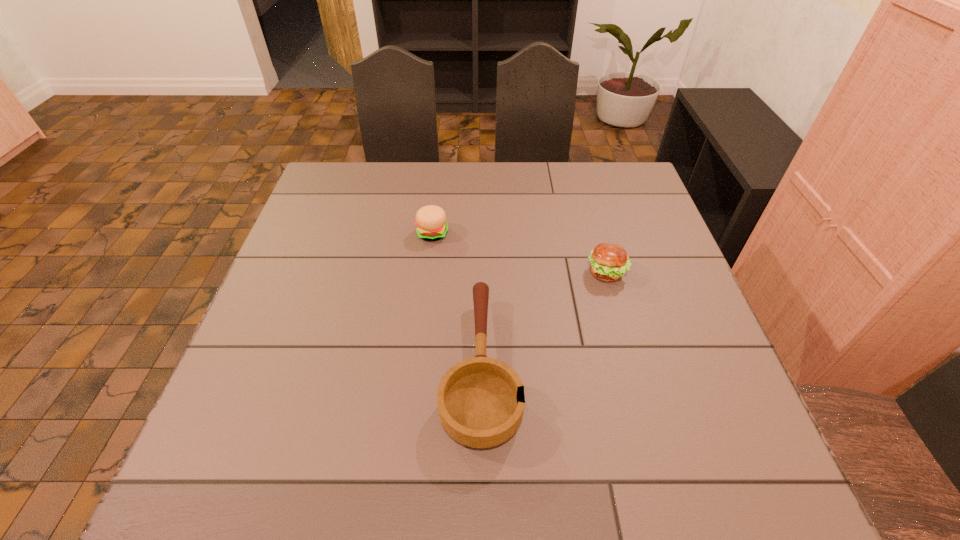
The image size is (960, 540). I want to click on vacant region located 0.310m with the handle on the side of the nearest object, so click(x=481, y=218).

The height and width of the screenshot is (540, 960). Find the location of `object that is at the near edge`. object that is at the near edge is located at coordinates (481, 401).

Find the location of a particular element. Image resolution: width=960 pixels, height=540 pixels. object situated at the right edge is located at coordinates (609, 262).

The image size is (960, 540). In the image, there is a desktop. Find the location of `vacant region at the far edge`. vacant region at the far edge is located at coordinates (397, 172).

You are a GUI agent. You are given a task and a screenshot of the screen. Output one action in this format:
    pyautogui.click(x=<x>, y=<y>)
    Task: Click on the vacant space at the near edge
    
    Given the screenshot: What is the action you would take?
    pyautogui.click(x=510, y=494)

At what (x,y) coordinates should I click in order to perform the action: click on vacant area at the left edge of the desktop. Please return your answer as a coordinate pair (x, y). This screenshot has width=960, height=540. Looking at the image, I should click on 280,321.

Identify the location of free space at the right edge of the desktop. (630, 216).

This screenshot has width=960, height=540. In order to click on free spot at the near left corner of the desktop in this screenshot , I will do `click(277, 466)`.

Image resolution: width=960 pixels, height=540 pixels. In the image, there is a desktop. Find the location of `free space at the far right corner`. free space at the far right corner is located at coordinates (618, 199).

This screenshot has width=960, height=540. What are the coordinates of `free space between the nearer hamburger and the left hamburger` in the screenshot? It's located at (519, 253).